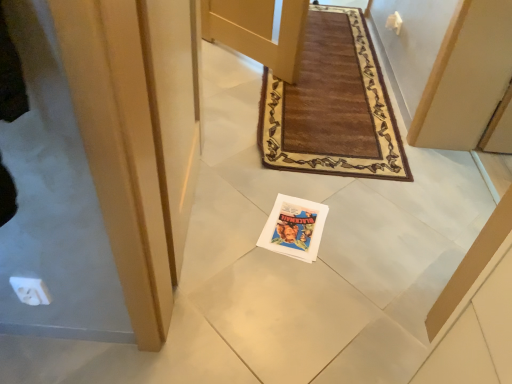
At what (x,y) coordinates should I click in order to perform the action: click on vacant point above matte paper magazine at center (from a real-world perspective). Please return your answer as a coordinate pair (x, y). Image resolution: width=512 pixels, height=384 pixels. Looking at the image, I should click on (294, 220).